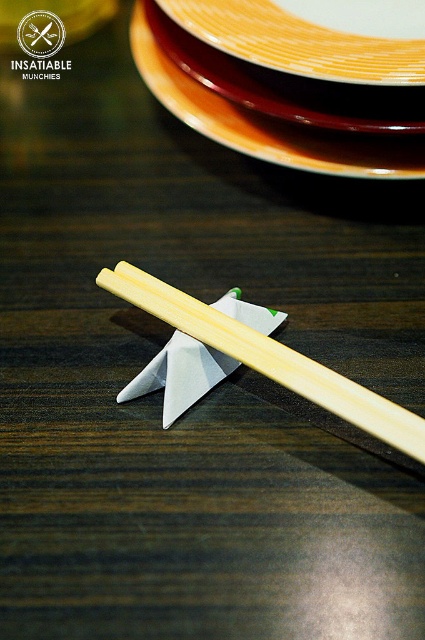
Question: Observing the image, what is the correct spatial positioning of natural wood chopsticks at center in reference to wooden chopsticks at center?

Choices:
 (A) right
 (B) left

Answer: (A)

Question: Among these points, which one is nearest to the camera?

Choices:
 (A) (282, 22)
 (B) (218, 332)

Answer: (B)

Question: Is natural wood chopsticks at center positioned at the back of wooden chopsticks at center?

Choices:
 (A) no
 (B) yes

Answer: (A)

Question: Which point appears farthest from the camera in this image?

Choices:
 (A) (280, 380)
 (B) (133, 32)

Answer: (B)

Question: Which of the following is the closest to the observer?

Choices:
 (A) matte ceramic platter at upper center
 (B) natural wood chopsticks at center
 (C) orange glazed plate at upper center

Answer: (B)

Question: From the image, what is the correct spatial relationship of natural wood chopsticks at center in relation to matte ceramic platter at upper center?

Choices:
 (A) below
 (B) above

Answer: (A)